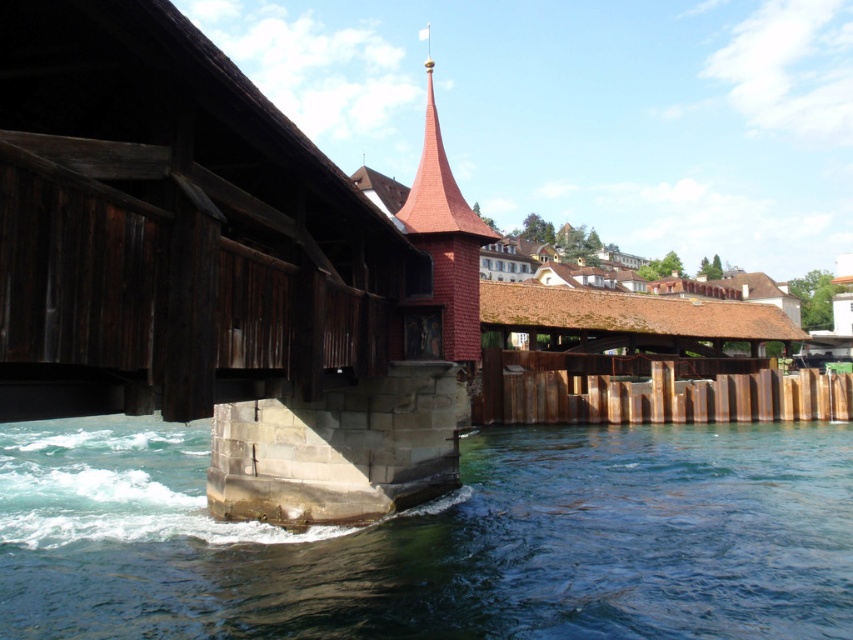
Which of these two, clear blue water at lower left or red wood spire at center, stands taller?

red wood spire at center

Is clear blue water at lower left to the left of red wood spire at center from the viewer's perspective?

Correct, you'll find clear blue water at lower left to the left of red wood spire at center.

Is point (500, 632) behind point (421, 211)?

No, it is not.

Where is `clear blue water at lower left`? clear blue water at lower left is located at coordinates (438, 540).